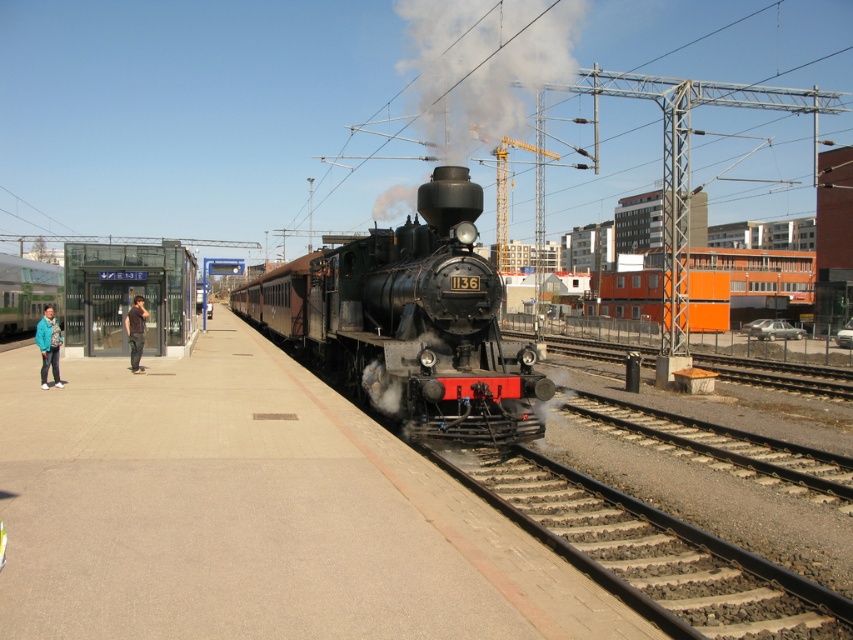
Question: Can you confirm if white smoke at center is positioned above dark gray pants at left?

Choices:
 (A) yes
 (B) no

Answer: (A)

Question: Among these points, which one is nearest to the camera?

Choices:
 (A) (15, 294)
 (B) (456, 28)

Answer: (A)

Question: Which of the following is the closest to the observer?

Choices:
 (A) (27, 262)
 (B) (57, 369)
 (C) (567, 67)

Answer: (B)

Question: Does polished black steam locomotive at center appear under matte green train at left?

Choices:
 (A) yes
 (B) no

Answer: (A)

Question: Can you confirm if white smoke at center is thinner than dark gray pants at left?

Choices:
 (A) no
 (B) yes

Answer: (A)

Question: Estimate the real-world distances between objects in this image. Which object is farther from the jeans at left?

Choices:
 (A) white smoke at center
 (B) matte green train at left
 (C) polished black steam locomotive at center
 (D) dark gray pants at left

Answer: (A)